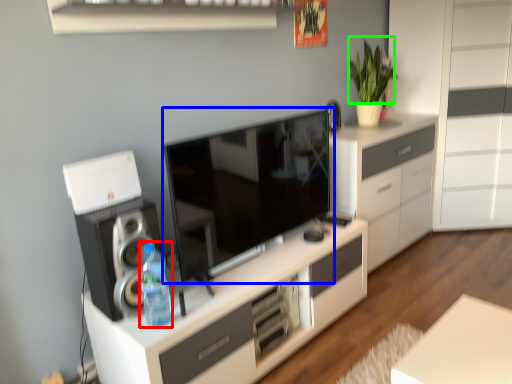
Question: Based on their relative distances, which object is farther from bottle (highlighted by a red box)? Choose from television (highlighted by a blue box) and plant (highlighted by a green box).

Choices:
 (A) television
 (B) plant

Answer: (B)